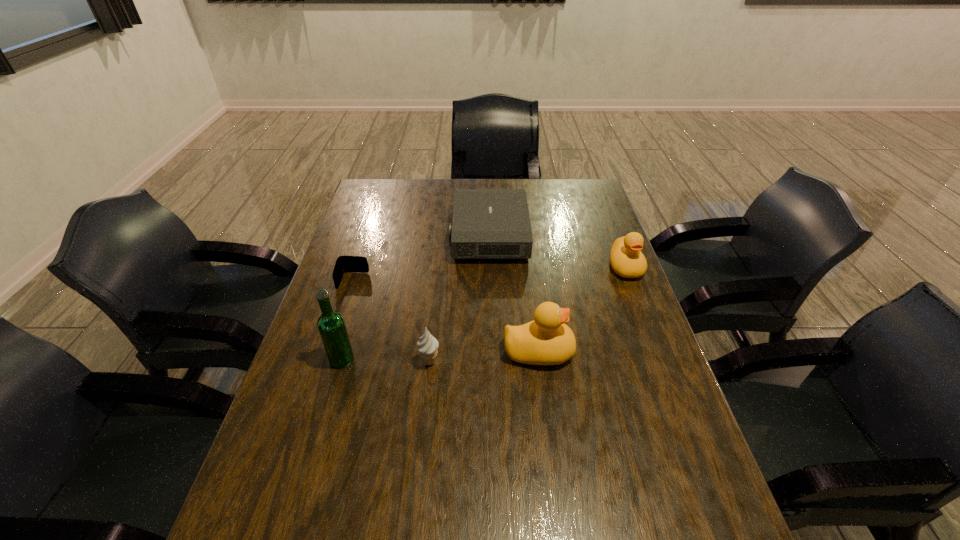
Locate an element on the screen. The image size is (960, 540). free space between the shorter duck and the fifth tallest object is located at coordinates (557, 251).

The height and width of the screenshot is (540, 960). What are the coordinates of `empty location between the left duck and the tallest object` in the screenshot? It's located at (441, 355).

This screenshot has width=960, height=540. I want to click on free area in between the fifth tallest object and the icecream, so click(459, 299).

Where is `empty location between the rightmost object and the beer bottle`? The width and height of the screenshot is (960, 540). empty location between the rightmost object and the beer bottle is located at coordinates (484, 313).

Locate an element on the screen. This screenshot has width=960, height=540. vacant space that's between the shortest object and the fifth tallest object is located at coordinates (421, 258).

At what (x,y) coordinates should I click in order to perform the action: click on empty space between the shorter duck and the icecream. Please return your answer as a coordinate pair (x, y). Looking at the image, I should click on (527, 314).

Find the location of a particular element. The image size is (960, 540). blank region between the projector and the tallest object is located at coordinates (416, 298).

Where is `object that is the fifth nearest to the right duck`? object that is the fifth nearest to the right duck is located at coordinates (331, 325).

Locate an element on the screen. the fifth closest object to the nearer duck is located at coordinates (343, 264).

At what (x,y) coordinates should I click in order to perform the action: click on blank space that satisfies the following two spatial constraints: 1. on the face of the shorter duck; 2. on the face of the fifth shortest object. Please return your answer as a coordinate pair (x, y). Image resolution: width=960 pixels, height=540 pixels. Looking at the image, I should click on (658, 352).